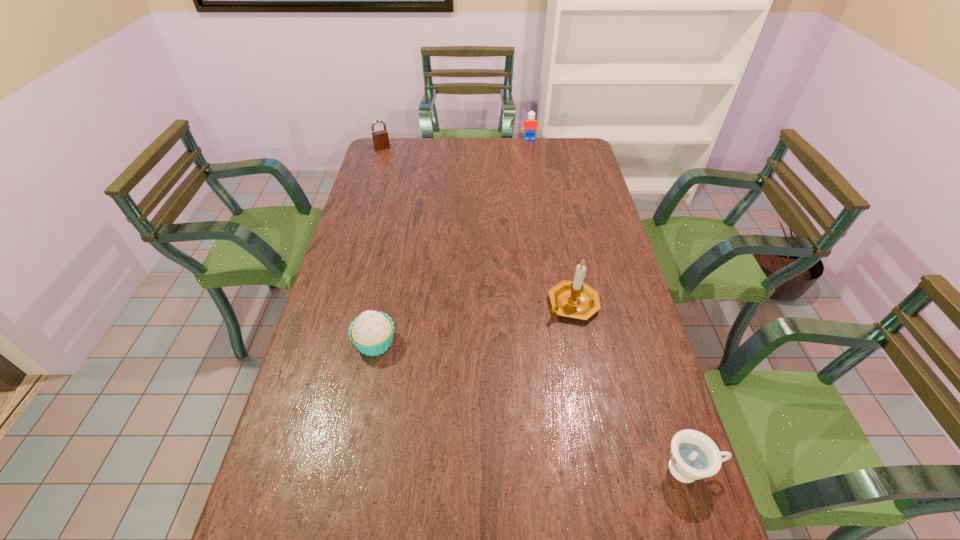
What are the coordinates of `free space located 0.120m with a handle on the third farthest object` in the screenshot? It's located at (549, 354).

Where is `vacant space located with a handle on the third farthest object`? The height and width of the screenshot is (540, 960). vacant space located with a handle on the third farthest object is located at coordinates (555, 340).

Identify the location of blank space located 0.320m with a handle on the third farthest object. The height and width of the screenshot is (540, 960). (519, 415).

Locate an element on the screen. This screenshot has height=540, width=960. free space located 0.300m on the front-facing side of the fourth nearest object is located at coordinates (405, 187).

You are a GUI agent. You are given a task and a screenshot of the screen. Output one action in this format:
    pyautogui.click(x=<x>, y=<y>)
    Task: Click on the vacant space located 0.100m on the front-facing side of the fourth nearest object
    This screenshot has height=540, width=960.
    Given the screenshot: What is the action you would take?
    pos(391,162)

Find the location of a particular element. free space located 0.130m on the front-facing side of the fourth nearest object is located at coordinates (393, 166).

In order to click on vacant space located 0.310m on the face of the farthest object in this screenshot , I will do 532,180.

Identify the location of blank space located on the face of the farthest object. The image size is (960, 540). (531, 173).

You are a GUI agent. You are given a task and a screenshot of the screen. Output one action in this format:
    pyautogui.click(x=<x>, y=<y>)
    Task: Click on the free space located 0.090m on the face of the farthest object
    The width and height of the screenshot is (960, 540).
    Given the screenshot: What is the action you would take?
    pyautogui.click(x=530, y=151)

At what (x,y) coordinates should I click in order to perform the action: click on padlock that is positioned at the far edge. Please return your answer as a coordinate pair (x, y). The image size is (960, 540). Looking at the image, I should click on (380, 138).